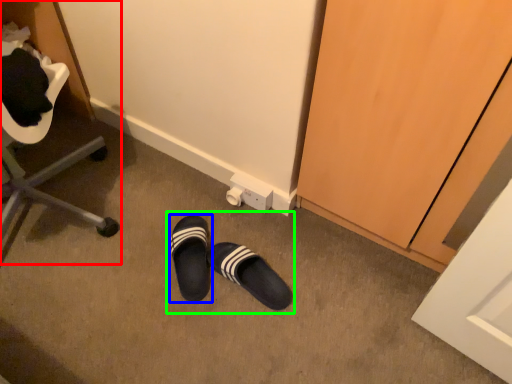
Question: Based on their relative distances, which object is farther from furniture (highlighted by a red box)? Choose from footwear (highlighted by a blue box) and leather shoe (highlighted by a green box).

Choices:
 (A) footwear
 (B) leather shoe

Answer: (A)